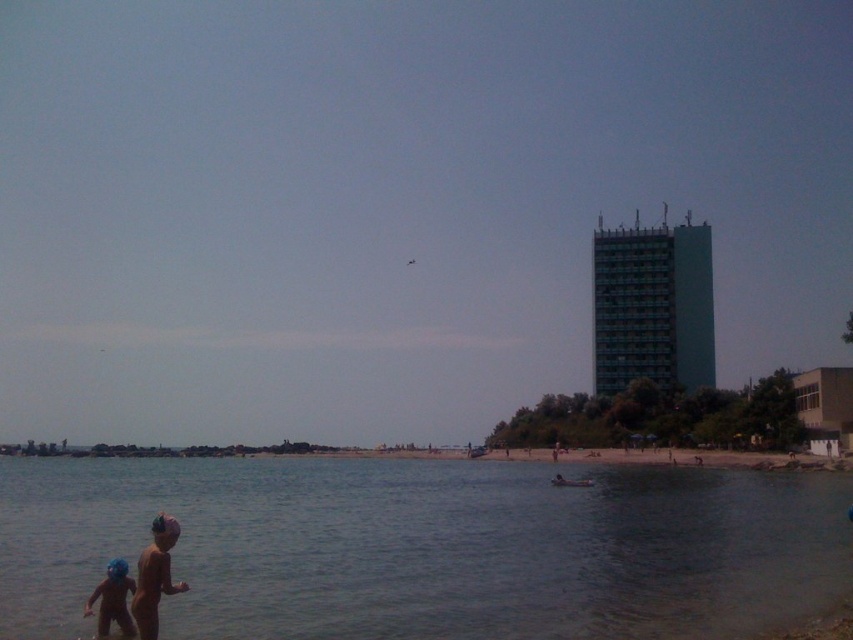
You are a lifeguard on duty and notice two items at the lower left of your view. The clear water at lower left and the blue rubber helmet at lower left. Which one takes up more space in your field of view?

The clear water at lower left takes up more space in the field of view because it is bigger than the blue rubber helmet at lower left.

Based on the photo, you are a lifeguard on duty and notice two items at the lower left of the beach scene. You see the clear water at lower left and the blue rubber helmet at lower left. Which item is positioned lower in the image?

The clear water at lower left is located below the blue rubber helmet at lower left, so the clear water at lower left is positioned lower in the image.

You are a parent watching your kids playing on the beach. You see the clear water at lower left and the blue rubber helmet at lower left. Which object is closer to the right side of the beach?

The clear water at lower left is positioned on the right side of blue rubber helmet at lower left, so it is closer to the right side of the beach.